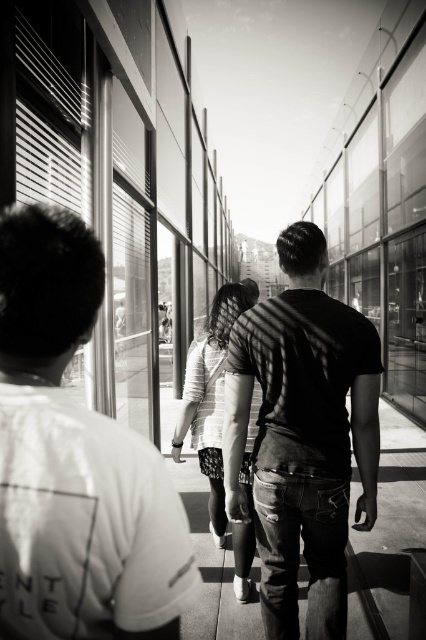
Question: Which of the following is the farthest from the observer?

Choices:
 (A) white cotton shirt at left
 (B) striped fabric at center
 (C) dark cotton t-shirt at center
 (D) ripped denim jeans at center

Answer: (D)

Question: Which of the following is the closest to the observer?

Choices:
 (A) (71, 580)
 (B) (242, 612)
 (C) (307, 369)

Answer: (A)

Question: Can you confirm if dark cotton t-shirt at center is positioned to the left of striped fabric at center?

Choices:
 (A) no
 (B) yes

Answer: (A)

Question: Can you confirm if dark cotton t-shirt at center is thinner than ripped denim jeans at center?

Choices:
 (A) yes
 (B) no

Answer: (A)

Question: Considering the real-world distances, which object is closest to the ripped denim jeans at center?

Choices:
 (A) striped fabric at center
 (B) dark cotton t-shirt at center

Answer: (A)

Question: Is dark cotton t-shirt at center further to the viewer compared to striped fabric at center?

Choices:
 (A) yes
 (B) no

Answer: (B)